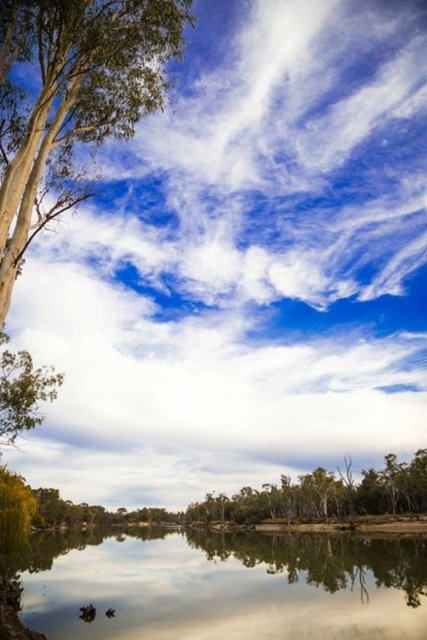
You are an artist trying to capture the reflection in the water. You notice two areas of water in the scene. Which area, the reflective glass water at lower center or the smooth water at lower center, would provide a better reflection for your painting?

The reflective glass water at lower center would provide a better reflection for your painting because it has a larger size compared to the smooth water at lower center, allowing for more detailed and expansive reflection capture.

You are standing at the edge of the scene and want to walk towards the reflective glass water at lower center and the smooth water at lower center. Which one will you encounter first?

You will encounter the reflective glass water at lower center first because it is in front of the smooth water at lower center.

You are standing at the edge of the water and see two points in the scene. The first point is labeled as point (353, 634) and the second is point (233, 544). Which point is closer to you?

Point (353, 634) is closer to the viewer than point (233, 544).